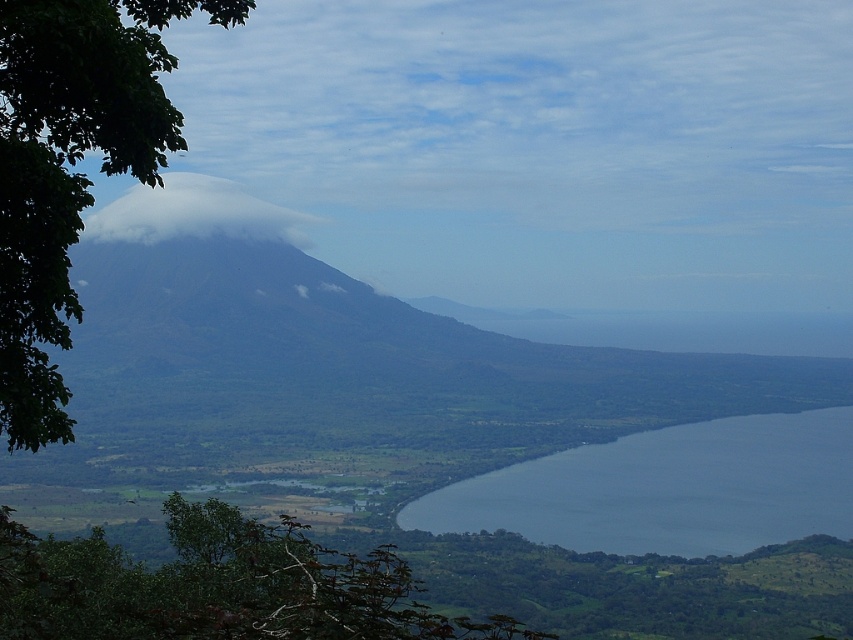
Question: Can you confirm if green leafy tree at lower left is bigger than white fluffy cloud at left?

Choices:
 (A) no
 (B) yes

Answer: (A)

Question: Is green leafy tree at left positioned in front of blue water at lower right?

Choices:
 (A) no
 (B) yes

Answer: (B)

Question: Which of these objects is positioned farthest from the blue water at lower right?

Choices:
 (A) green leafy tree at left
 (B) white fluffy cloud at left

Answer: (A)

Question: Is green leafy tree at lower left below blue water at lower right?

Choices:
 (A) yes
 (B) no

Answer: (B)

Question: Among these objects, which one is nearest to the camera?

Choices:
 (A) green leafy tree at lower left
 (B) blue water at lower right
 (C) green leafy tree at left

Answer: (A)

Question: Which object appears closest to the camera in this image?

Choices:
 (A) green leafy tree at left
 (B) white fluffy cloud at left

Answer: (A)